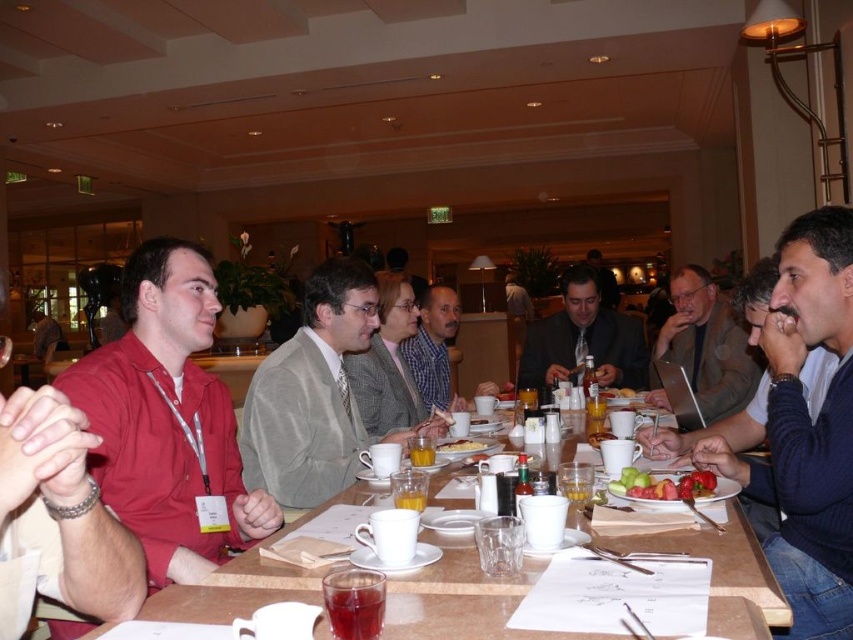
Can you confirm if dark gray suit at center is smaller than shiny plastic plate at center?

Incorrect, dark gray suit at center is not smaller in size than shiny plastic plate at center.

Is dark gray suit at center to the right of shiny plastic plate at center from the viewer's perspective?

Correct, you'll find dark gray suit at center to the right of shiny plastic plate at center.

Is point (572, 321) positioned behind point (625, 496)?

Yes, it is behind point (625, 496).

The width and height of the screenshot is (853, 640). I want to click on dark gray suit at center, so click(582, 339).

What do you see at coordinates (805, 428) in the screenshot? I see `dark blue sweater at right` at bounding box center [805, 428].

Looking at this image, is dark blue sweater at right further to camera compared to dark gray suit at center?

No.

The width and height of the screenshot is (853, 640). Describe the element at coordinates (805, 428) in the screenshot. I see `dark blue sweater at right` at that location.

Where is `dark blue sweater at right`? This screenshot has height=640, width=853. dark blue sweater at right is located at coordinates (805, 428).

Does gray wool suit at center come behind shiny plastic plate at center?

Yes, gray wool suit at center is further from the viewer.

Can you confirm if gray wool suit at center is shorter than shiny plastic plate at center?

No, gray wool suit at center is not shorter than shiny plastic plate at center.

Measure the distance between point (x=743, y=388) and camera.

The distance of point (x=743, y=388) from camera is 10.10 feet.

Find the location of a particular element. The height and width of the screenshot is (640, 853). gray wool suit at center is located at coordinates point(706,344).